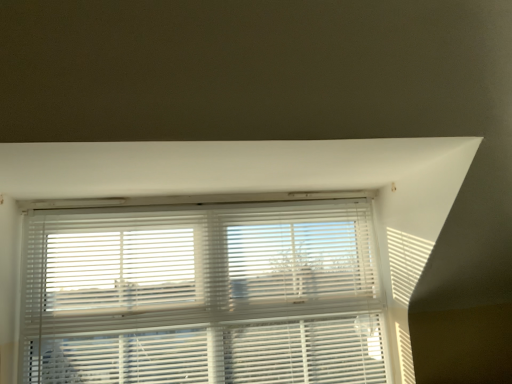
What do you see at coordinates (203, 295) in the screenshot?
I see `white plastic blinds at center` at bounding box center [203, 295].

This screenshot has width=512, height=384. Find the location of `white plastic blinds at center`. white plastic blinds at center is located at coordinates (203, 295).

You are a GUI agent. You are given a task and a screenshot of the screen. Output one action in this format:
    pyautogui.click(x=<x>, y=<y>)
    Task: Click on the white plastic blinds at center
    
    Given the screenshot: What is the action you would take?
    pyautogui.click(x=203, y=295)